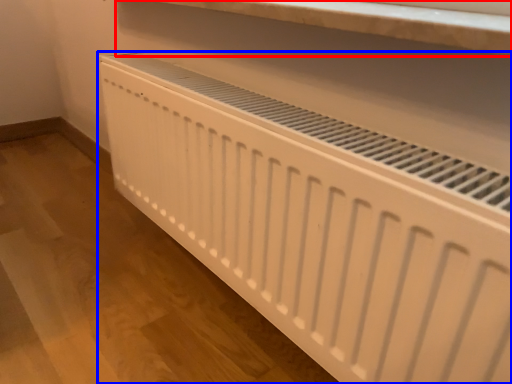
Question: Among these objects, which one is nearest to the camera, shelf (highlighted by a red box) or home appliance (highlighted by a blue box)?

Choices:
 (A) shelf
 (B) home appliance

Answer: (B)